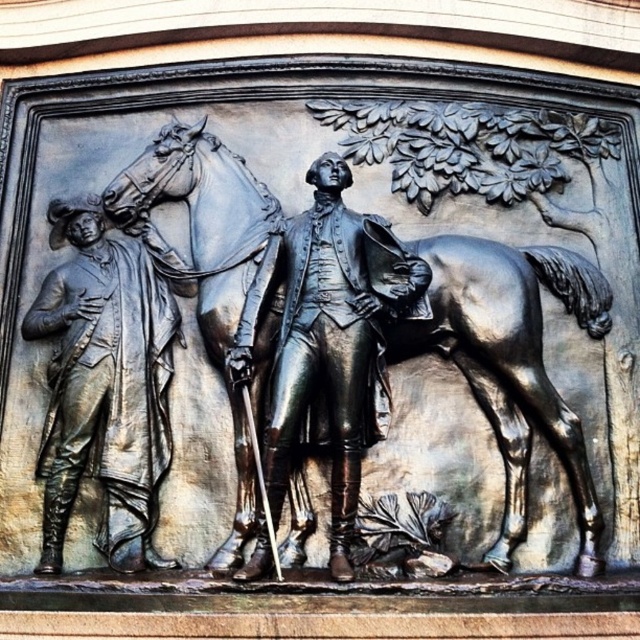
Describe the element at coordinates (106, 380) in the screenshot. This screenshot has height=640, width=640. I see `bronze figure at left` at that location.

Does bronze figure at left appear on the left side of shiny bronze statue at center?

Yes, bronze figure at left is to the left of shiny bronze statue at center.

Between point (128, 300) and point (275, 461), which one is positioned behind?

The point (128, 300) is behind.

Where is `bronze figure at left`? This screenshot has height=640, width=640. bronze figure at left is located at coordinates (106, 380).

Based on the photo, between polished bronze horse at center and bronze figure at left, which one is positioned higher?

polished bronze horse at center is higher up.

Describe the element at coordinates (358, 330) in the screenshot. This screenshot has height=640, width=640. I see `polished bronze horse at center` at that location.

Where is `polished bronze horse at center`? polished bronze horse at center is located at coordinates (358, 330).

Between polished bronze horse at center and shiny bronze statue at center, which one has more height?

polished bronze horse at center

Is polished bronze horse at center thinner than shiny bronze statue at center?

Incorrect, polished bronze horse at center's width is not less than shiny bronze statue at center's.

The height and width of the screenshot is (640, 640). In order to click on polished bronze horse at center in this screenshot , I will do `click(358, 330)`.

Where is `polished bronze horse at center`? polished bronze horse at center is located at coordinates (358, 330).